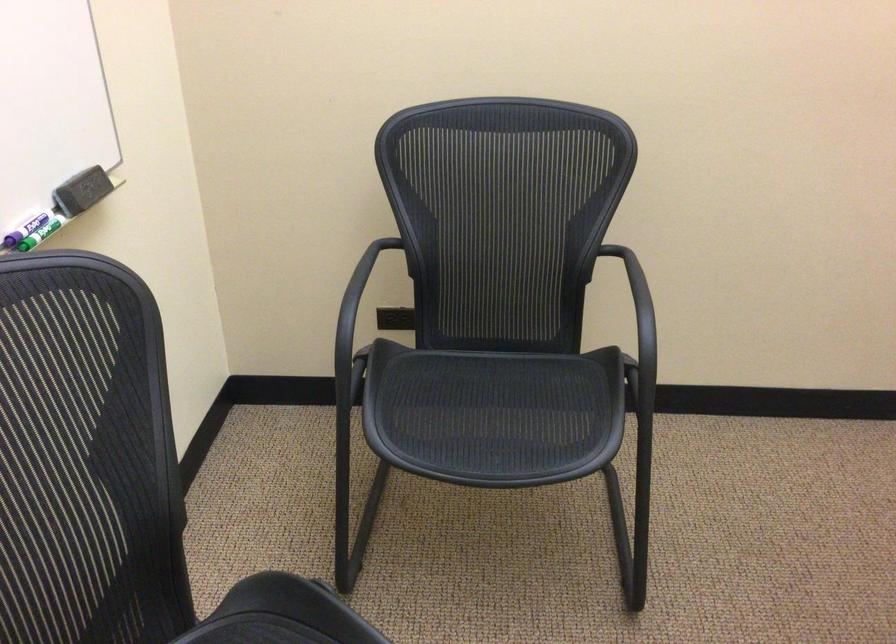
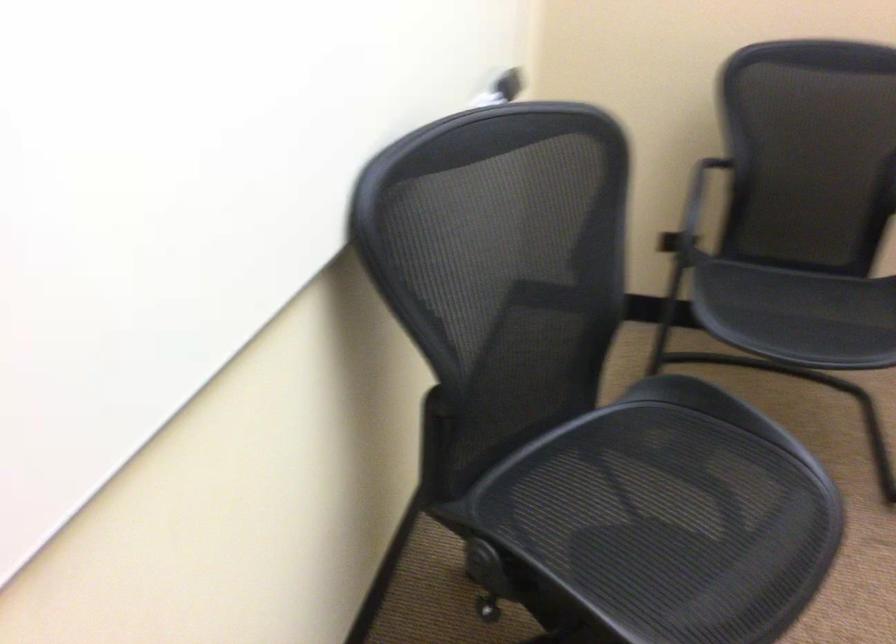
Find the pixel in the second image that matches point 351,330 in the first image.

(692, 212)